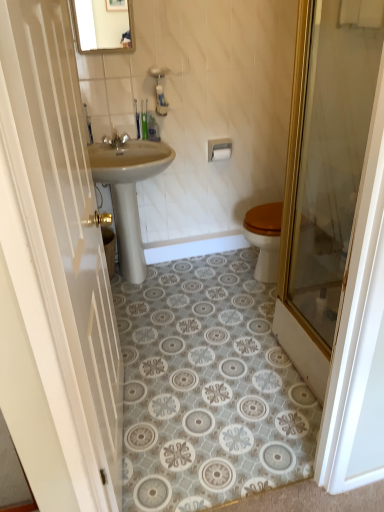
Question: From a real-world perspective, relative to white glossy door at left, arranged as the 1th door when viewed from the left, is white matte toilet paper at upper center vertically above or below?

Choices:
 (A) below
 (B) above

Answer: (A)

Question: Is white matte toilet paper at upper center in front of or behind white glossy door at left, arranged as the 1th door when viewed from the left, in the image?

Choices:
 (A) behind
 (B) front

Answer: (A)

Question: Which of these objects is positioned closest to the matte glass mirror at upper center?

Choices:
 (A) white glossy door at left, arranged as the 1th door when viewed from the left
 (B) beige ceramic sink at center
 (C) translucent glass door at right, marked as the first door in a right-to-left arrangement
 (D) silver metallic faucet at upper center
 (E) white matte toilet paper at upper center

Answer: (D)

Question: Based on their relative distances, which object is farther from the silver metallic towel bar at upper center?

Choices:
 (A) white glossy door at left, arranged as the 1th door when viewed from the left
 (B) white matte toilet paper at upper center
 (C) translucent glass door at right, marked as the first door in a right-to-left arrangement
 (D) matte glass mirror at upper center
 (E) silver metallic faucet at upper center

Answer: (A)